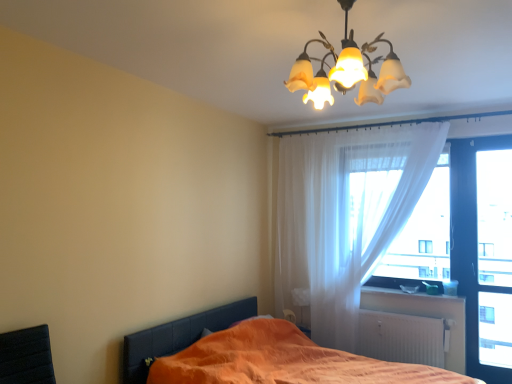
Image resolution: width=512 pixels, height=384 pixels. Find the location of `blank space situated above white plastic window sill at lower right (from a real-world perspective)`. blank space situated above white plastic window sill at lower right (from a real-world perspective) is located at coordinates (409, 290).